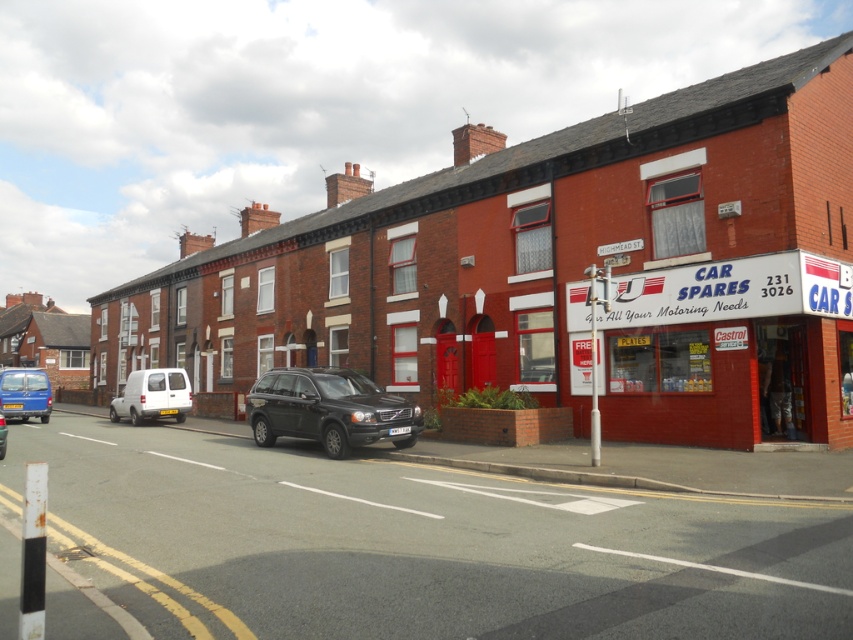
You are a delivery person trying to park your van in the residential street. You see a shiny black suv at center and a matte black suv at center. Can you park your van between them?

The shiny black suv at center is positioned over matte black suv at center, so there is no space between them for the van to park.

You are a delivery driver who needs to park your vehicle in the parking spot located between the shiny black suv at center and the blue matte van at center. Your delivery van is 2.1 meters wide. Can you safely park your van between them without touching either vehicle?

The shiny black suv at center is wider than the blue matte van at center. Since your delivery van is 2.1 meters wide, you need to check the available space between them. However, the exact distance isn not provided, so it is uncertain if there is enough space. Please measure the gap before attempting to park.

In the scene shown: You are a delivery driver who needs to park your vehicle between the white matte van at center and the matte black suv at center. Your vehicle is 2 meters wide. Can you fit your vehicle between them?

The white matte van at center is thinner than the matte black suv at center, but the exact distance between them isn